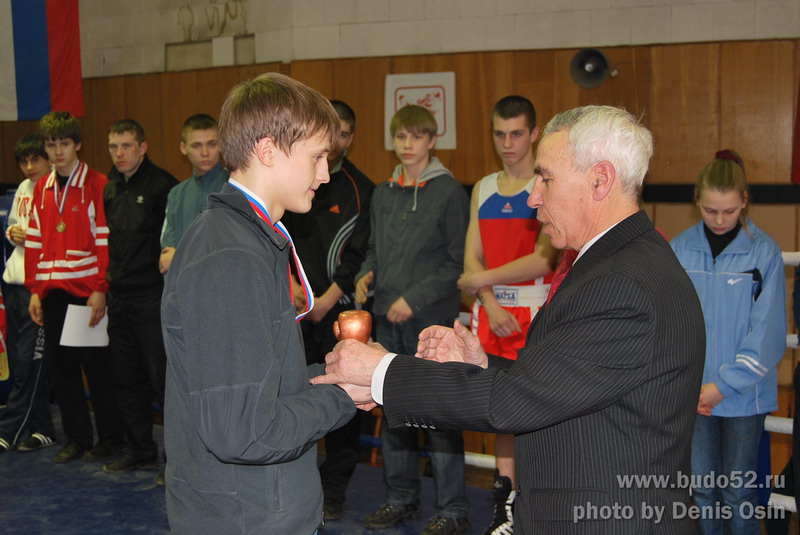
The width and height of the screenshot is (800, 535). In order to click on speaker on wall in this screenshot , I will do `click(504, 248)`, `click(585, 66)`.